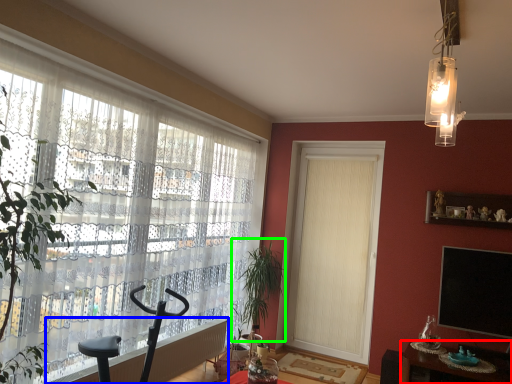
Question: Which object is positioned closest to table (highlighted by a red box)? Select from radiator (highlighted by a blue box) and plant (highlighted by a green box).

Choices:
 (A) radiator
 (B) plant

Answer: (B)